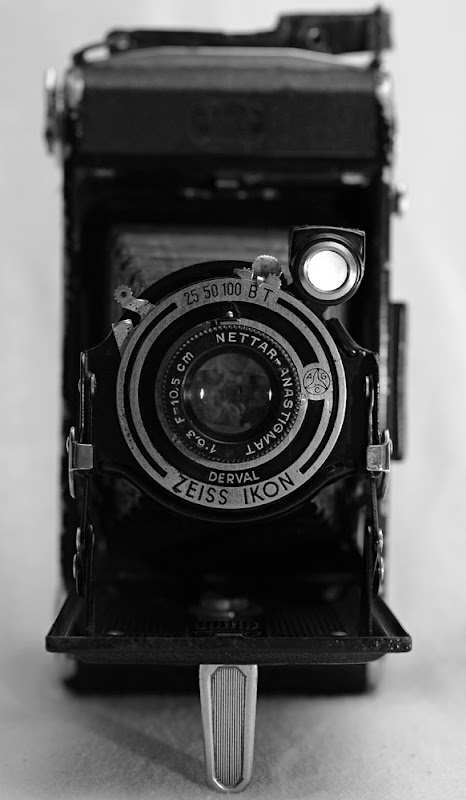
Locate an element on the screen. light is located at coordinates (321, 274).